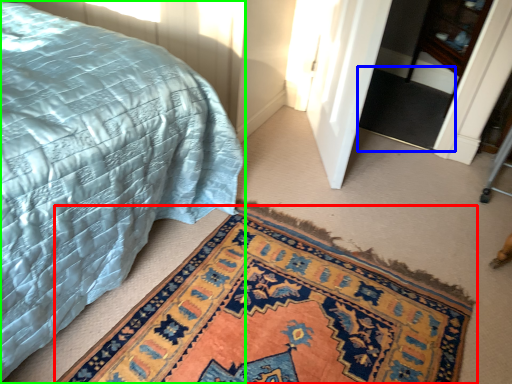
Question: Which object is the farthest from mat (highlighted by a red box)? Choose among these: doormat (highlighted by a blue box) or bed (highlighted by a green box).

Choices:
 (A) doormat
 (B) bed

Answer: (A)